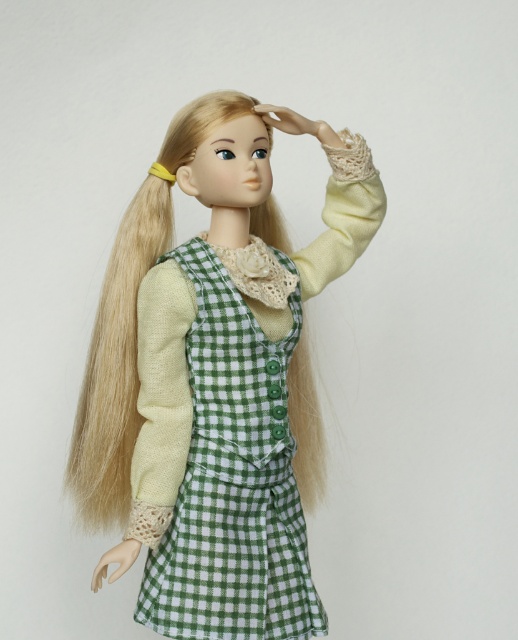
You are a fashion designer trying to create a new outfit for the doll. You have both the green checkered dress at center and the green checkered apron at center. If you want to ensure the apron doesn not overwhelm the dress, which one should you choose as the base?

The green checkered apron at center should be chosen as the base since the dress at center is wider, allowing the apron to complement without overpowering it.

The user is trying to determine if the green checkered dress at center and the green checkered apron at center are overlapping in the image. Based on the description, are they overlapping?

The green checkered dress at center is 1.25 inches away from green checkered apron at center, so they are not overlapping.